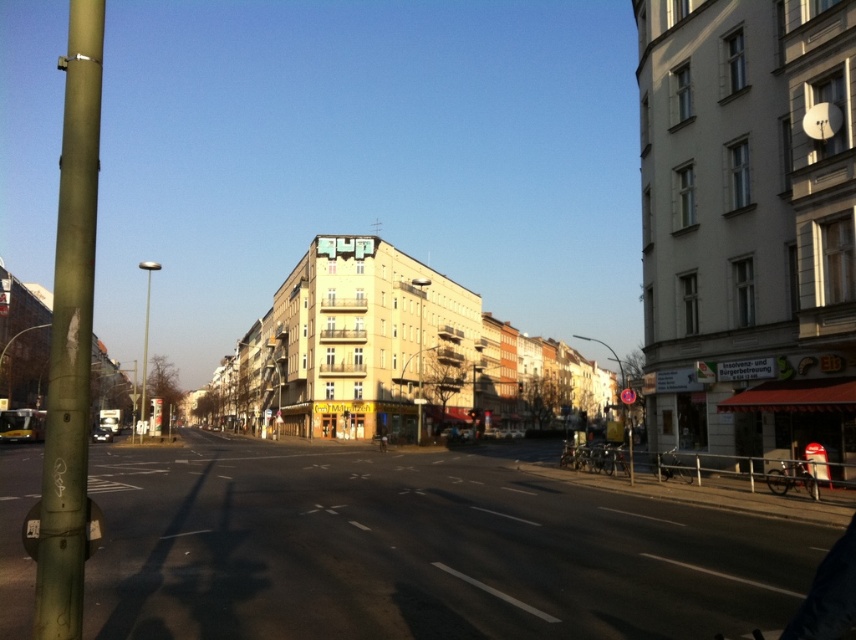
Question: Observing the image, what is the correct spatial positioning of green matte pole at left in reference to metallic reflective sign at center?

Choices:
 (A) left
 (B) right

Answer: (A)

Question: Can you confirm if green matte pole at left is positioned above metallic reflective sign at center?

Choices:
 (A) no
 (B) yes

Answer: (B)

Question: Which of the following is the farthest from the observer?

Choices:
 (A) (619, 362)
 (B) (81, 44)

Answer: (A)

Question: Which point appears farthest from the camera in this image?

Choices:
 (A) (66, 92)
 (B) (616, 355)

Answer: (B)

Question: Which object appears farthest from the camera in this image?

Choices:
 (A) green matte pole at left
 (B) metallic reflective sign at center

Answer: (B)

Question: Can you confirm if green matte pole at left is bigger than metallic reflective sign at center?

Choices:
 (A) no
 (B) yes

Answer: (B)